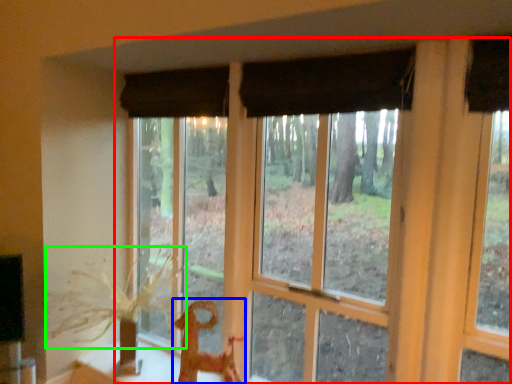
Question: Considering the real-world distances, which object is closest to window (highlighted by a red box)? animal (highlighted by a blue box) or plant (highlighted by a green box).

Choices:
 (A) animal
 (B) plant

Answer: (A)